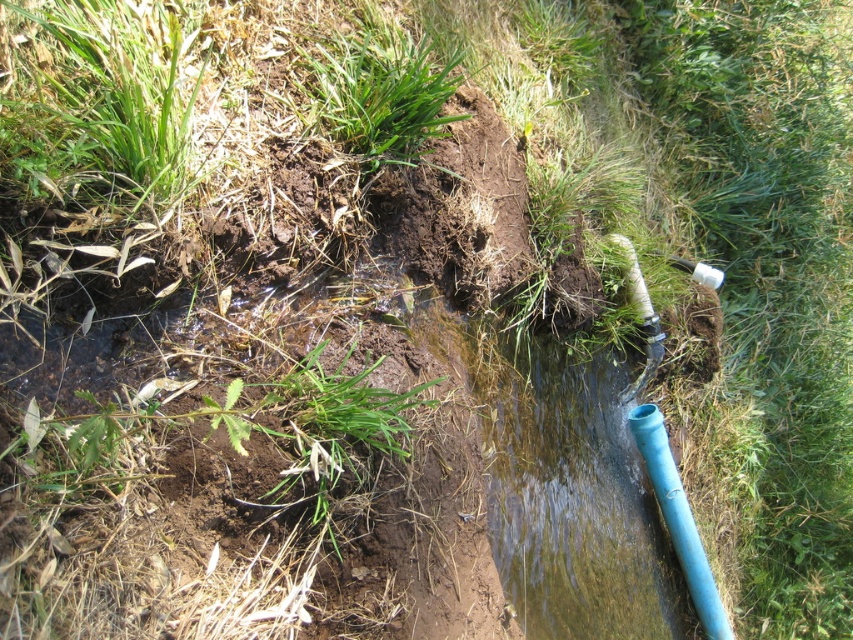
At what (x,y) coordinates should I click in order to perform the action: click on blue plastic pipe at lower right. Please return your answer as a coordinate pair (x, y). This screenshot has width=853, height=640. Looking at the image, I should click on (677, 516).

What do you see at coordinates (677, 516) in the screenshot? This screenshot has width=853, height=640. I see `blue plastic pipe at lower right` at bounding box center [677, 516].

At what (x,y) coordinates should I click in order to perform the action: click on blue plastic pipe at lower right. Please return your answer as a coordinate pair (x, y). Looking at the image, I should click on (677, 516).

How much distance is there between green grass at center and blue plastic pipe at lower right?

green grass at center is 6.41 feet away from blue plastic pipe at lower right.

Is green grass at center positioned at the back of blue plastic pipe at lower right?

No, green grass at center is closer to the viewer.

Does point (428, 120) come closer to viewer compared to point (698, 609)?

Yes, point (428, 120) is in front of point (698, 609).

What are the coordinates of `green grass at center` in the screenshot? It's located at (381, 88).

Who is positioned more to the left, green grass at center or white textured hose at center right?

From the viewer's perspective, green grass at center appears more on the left side.

Between point (368, 147) and point (643, 374), which one is positioned in front?

Point (368, 147)

Find the location of `green grass at center`. green grass at center is located at coordinates (381, 88).